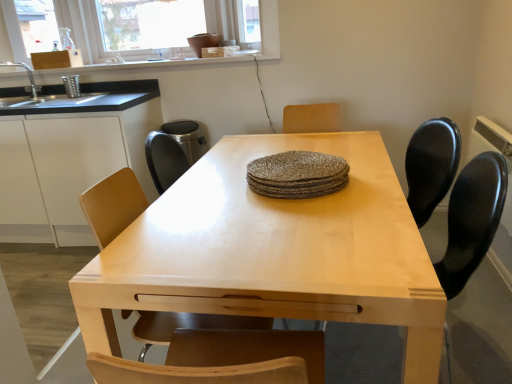
Question: Considering their positions, is black granite countertop at left located in front of or behind light wood table at center?

Choices:
 (A) front
 (B) behind

Answer: (B)

Question: Considering the positions of black granite countertop at left and light wood table at center in the image, is black granite countertop at left wider or thinner than light wood table at center?

Choices:
 (A) wide
 (B) thin

Answer: (B)

Question: Which object is the farthest from the light wood table at center?

Choices:
 (A) light wood chair at center
 (B) black granite countertop at left
 (C) transparent glass window screen at upper center
 (D) black plastic swivel chair at right
 (E) white matte cabinet at left

Answer: (C)

Question: Based on their relative distances, which object is farther from the light wood chair at center?

Choices:
 (A) black granite countertop at left
 (B) white matte cabinet at left
 (C) light wood table at center
 (D) black plastic swivel chair at right
 (E) transparent glass window screen at upper center

Answer: (E)